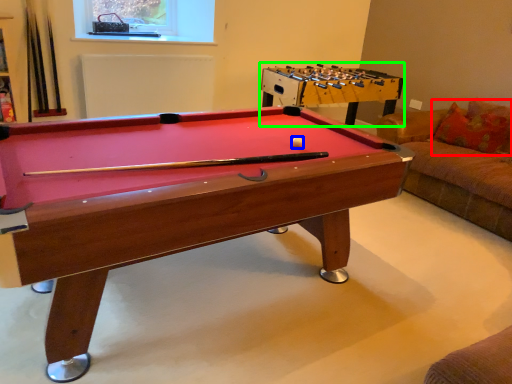
Question: Considering the real-world distances, which object is closest to pillow (highlighted by a red box)? ball (highlighted by a blue box) or table (highlighted by a green box).

Choices:
 (A) ball
 (B) table

Answer: (B)